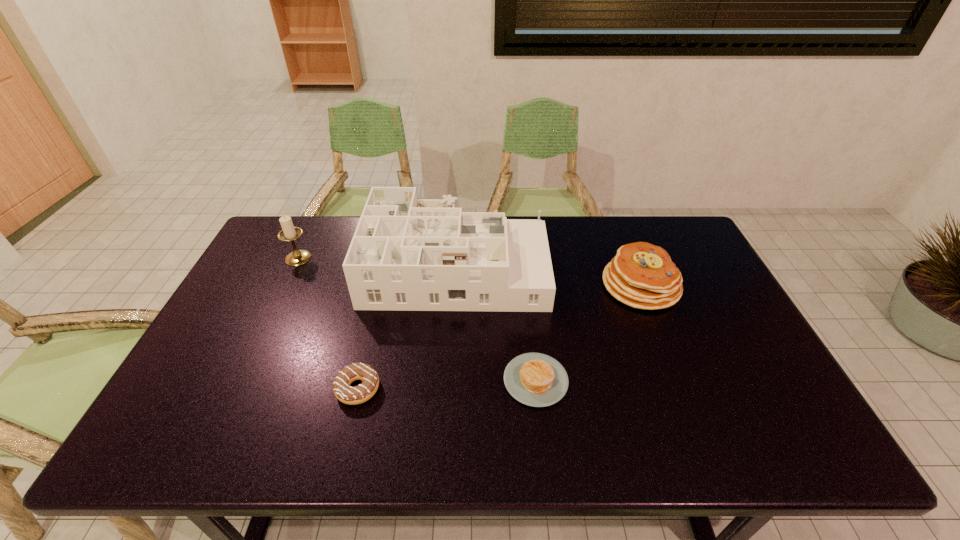
You are a GUI agent. You are given a task and a screenshot of the screen. Output one action in this format:
    pyautogui.click(x=<x>, y=<y>)
    Task: Click on the free spot located 0.300m on the back of the doughnut
    Image resolution: width=960 pixels, height=540 pixels.
    Given the screenshot: What is the action you would take?
    pyautogui.click(x=382, y=289)

Locate an element on the screen. The height and width of the screenshot is (540, 960). vacant area situated on the left of the left pancake is located at coordinates (354, 380).

Identify the location of dollhouse positioned at the far edge. Image resolution: width=960 pixels, height=540 pixels. (407, 254).

In order to click on candle holder at the far edge in this screenshot , I will do point(288,233).

Identify the location of object that is at the left edge. This screenshot has height=540, width=960. (288, 233).

Identify the location of object that is positioned at the right edge. (641, 275).

Image resolution: width=960 pixels, height=540 pixels. Identify the location of object that is at the far left corner. (288, 233).

This screenshot has height=540, width=960. Find the location of `vacant space at the far edge of the desktop`. vacant space at the far edge of the desktop is located at coordinates (514, 218).

The image size is (960, 540). In order to click on free space at the near edge in this screenshot , I will do `click(691, 457)`.

Find the location of `free space at the left edge`. free space at the left edge is located at coordinates [222, 376].